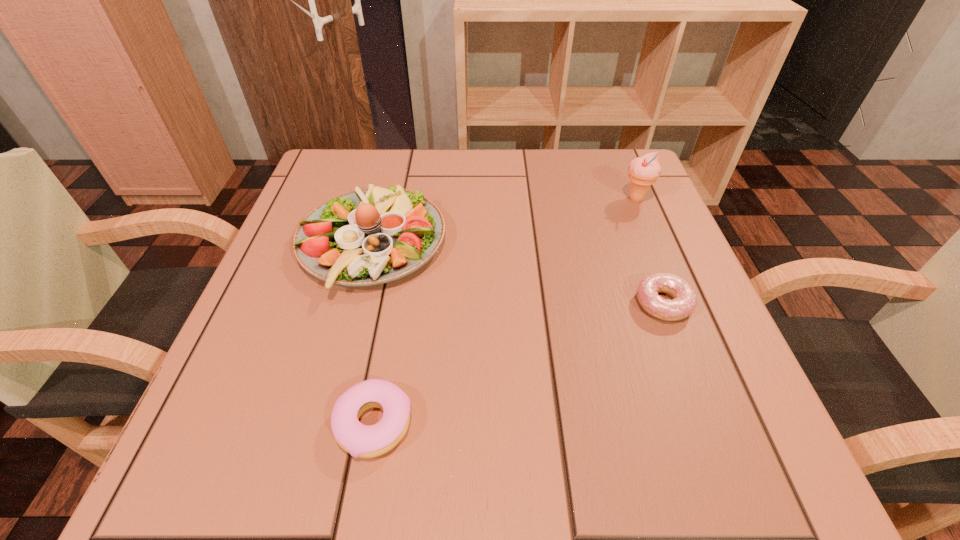
Where is `salad plate situated at the far edge`? This screenshot has height=540, width=960. salad plate situated at the far edge is located at coordinates (372, 236).

Locate an element on the screen. object at the near edge is located at coordinates (366, 441).

Where is `object positioned at the left edge`? The width and height of the screenshot is (960, 540). object positioned at the left edge is located at coordinates (372, 236).

Where is `icecream that is positioned at the right edge`? The image size is (960, 540). icecream that is positioned at the right edge is located at coordinates (643, 171).

The height and width of the screenshot is (540, 960). What are the coordinates of `doughnut at the right edge` in the screenshot? It's located at (684, 302).

Where is `object that is at the far left corner`? This screenshot has height=540, width=960. object that is at the far left corner is located at coordinates (372, 236).

The width and height of the screenshot is (960, 540). I want to click on object present at the far right corner, so click(x=643, y=171).

In the image, there is a desktop. Where is `blank space at the far edge`? blank space at the far edge is located at coordinates (510, 151).

Where is `vacant region at the near edge of the desktop`? The image size is (960, 540). vacant region at the near edge of the desktop is located at coordinates (622, 423).

This screenshot has width=960, height=540. I want to click on vacant space at the left edge of the desktop, so click(x=288, y=299).